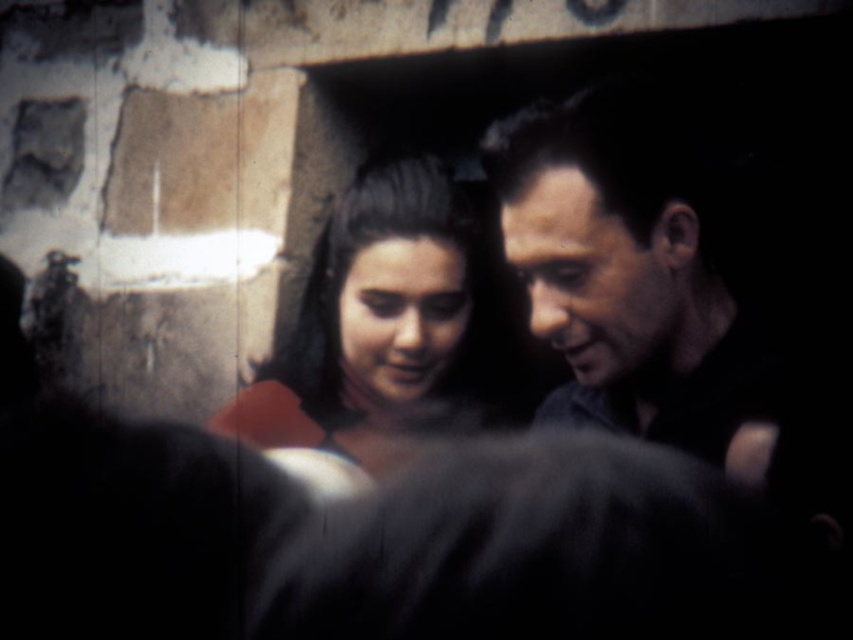
Is point (524, 163) farther from camera compared to point (463, 388)?

No, (524, 163) is in front of (463, 388).

The height and width of the screenshot is (640, 853). What do you see at coordinates (630, 284) in the screenshot?
I see `smooth dark hair at right` at bounding box center [630, 284].

In order to click on smooth dark hair at right in this screenshot , I will do `click(630, 284)`.